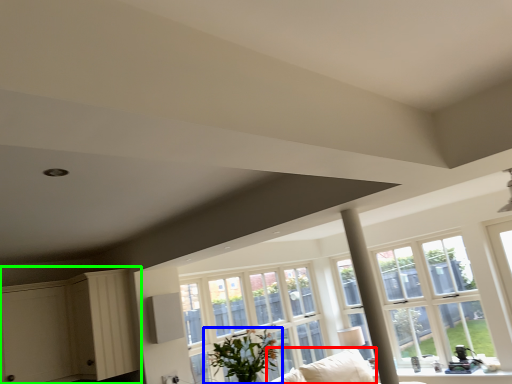
Question: Estimate the real-world distances between objects in this image. Which object is closer to couch (highlighted by a red box), houseplant (highlighted by a blue box) or dresser (highlighted by a green box)?

Choices:
 (A) houseplant
 (B) dresser

Answer: (A)